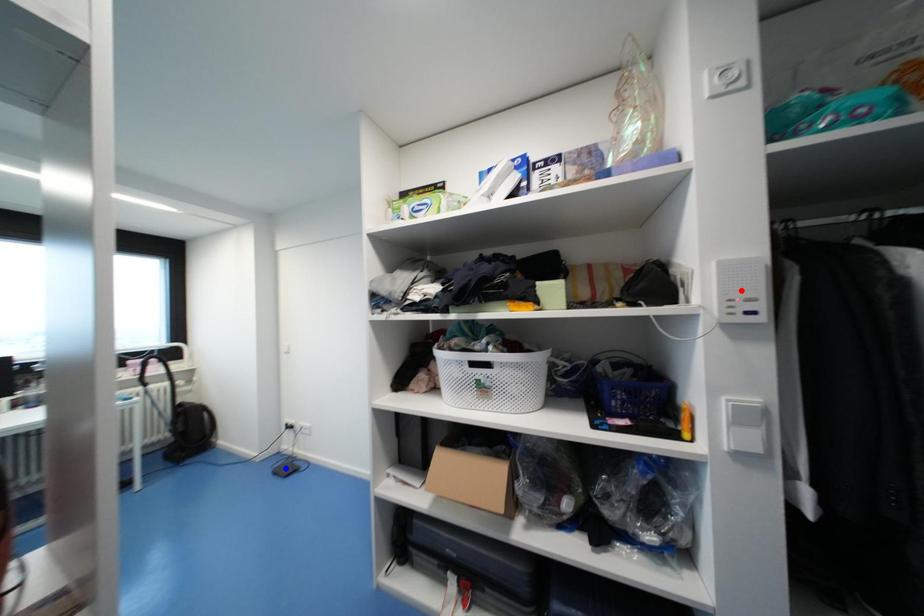
Question: In the image, two points are highlighted. Which point is nearer to the camera? Reply with the corresponding letter.

Choices:
 (A) blue point
 (B) red point

Answer: (B)